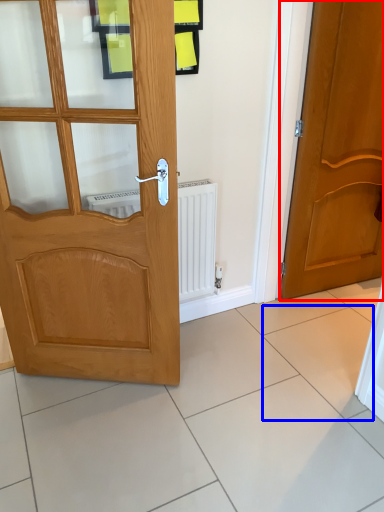
Question: Which object is closer to the camera taking this photo, door (highlighted by a red box) or ceramic tile (highlighted by a blue box)?

Choices:
 (A) door
 (B) ceramic tile

Answer: (A)